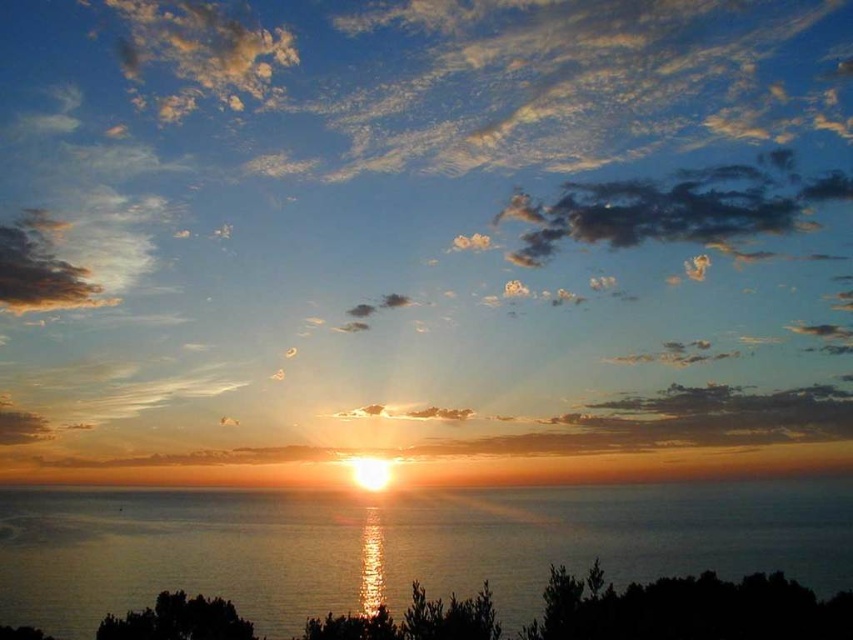
You are a photographer standing at the shore of the sea. You want to take a photo of the sunset and have both point (x=90, y=83) and point (x=337, y=600) in the frame. Which point will appear closer to the camera in the photo?

Point (x=90, y=83) will appear closer to the camera in the photo because it is further to the camera than point (x=337, y=600).

You are an artist painting the sunset scene. You need to place the glistening silver water at center and the dark gray fluffy cloud at upper center in your painting. According to the scene description, which object should be positioned to the left of the other?

The glistening silver water at center should be positioned to the left of the dark gray fluffy cloud at upper center because the description states that the glistening silver water at center is to the left of the dark gray fluffy cloud at upper center.